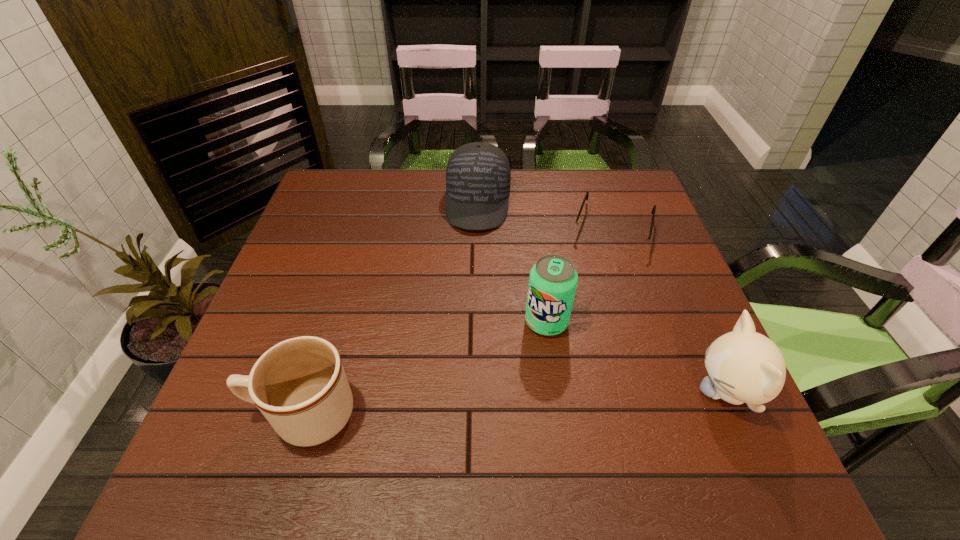
At what (x,y) coordinates should I click in order to perform the action: click on mug. Please return your answer as a coordinate pair (x, y). This screenshot has height=540, width=960. Looking at the image, I should click on pos(299,385).

Where is `kitten`? The height and width of the screenshot is (540, 960). kitten is located at coordinates (744, 366).

Find the location of a particular element. The image size is (960, 540). the shortest object is located at coordinates [630, 242].

Find the location of a particular element. The width and height of the screenshot is (960, 540). the fourth object from right to left is located at coordinates (478, 176).

Identify the location of pop soda. (553, 279).

Find the location of a particular element. The image size is (960, 540). the third object from left to right is located at coordinates (553, 279).

The height and width of the screenshot is (540, 960). What are the coordinates of `vacant space situated on the side of the mug with the handle` in the screenshot? It's located at (226, 414).

This screenshot has width=960, height=540. Identify the location of free space located 0.100m on the face of the kitten. (643, 392).

At what (x,y) coordinates should I click in order to perform the action: click on vacant space located on the face of the kitten. Please return your answer as a coordinate pair (x, y). Looking at the image, I should click on (502, 392).

In order to click on free point located 0.130m on the face of the kitten in this screenshot , I will do `click(628, 392)`.